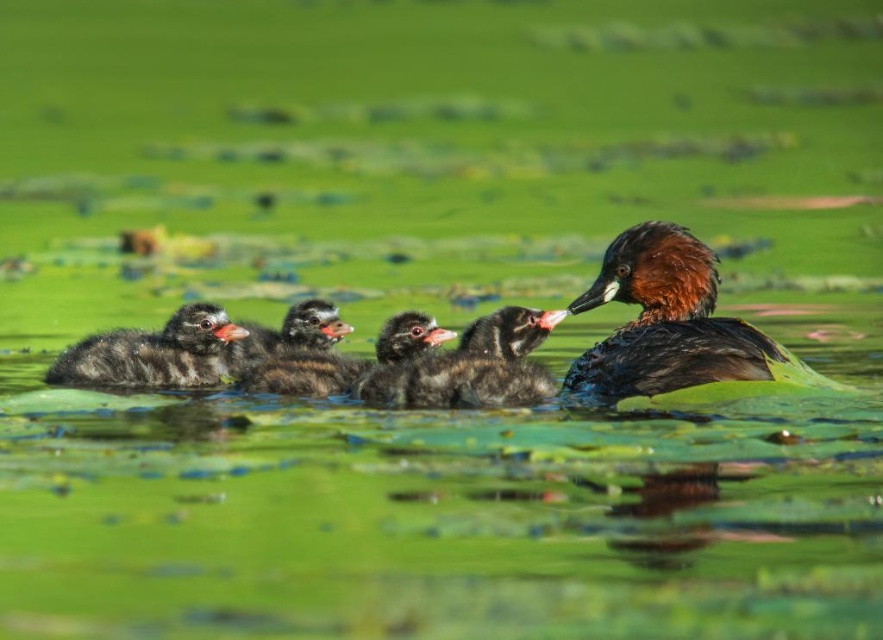
Question: Is brown glossy duck at center to the left of dark brown fluffy ducklings at center from the viewer's perspective?

Choices:
 (A) no
 (B) yes

Answer: (A)

Question: Which of these objects is positioned closest to the black fluffy duckling at center?

Choices:
 (A) brown glossy duck at center
 (B) dark brown fluffy duckling at center

Answer: (B)

Question: In this image, where is dark gray fluffy duckling at left located relative to black fluffy duckling at center?

Choices:
 (A) below
 (B) above

Answer: (A)

Question: Which point is closer to the camera taking this photo?

Choices:
 (A) (245, 372)
 (B) (684, 372)

Answer: (B)

Question: Which object appears farthest from the camera in this image?

Choices:
 (A) black fluffy duckling at center
 (B) dark gray fluffy duckling at left

Answer: (B)

Question: Is dark brown fluffy duckling at center wider than black fluffy duckling at center?

Choices:
 (A) yes
 (B) no

Answer: (A)